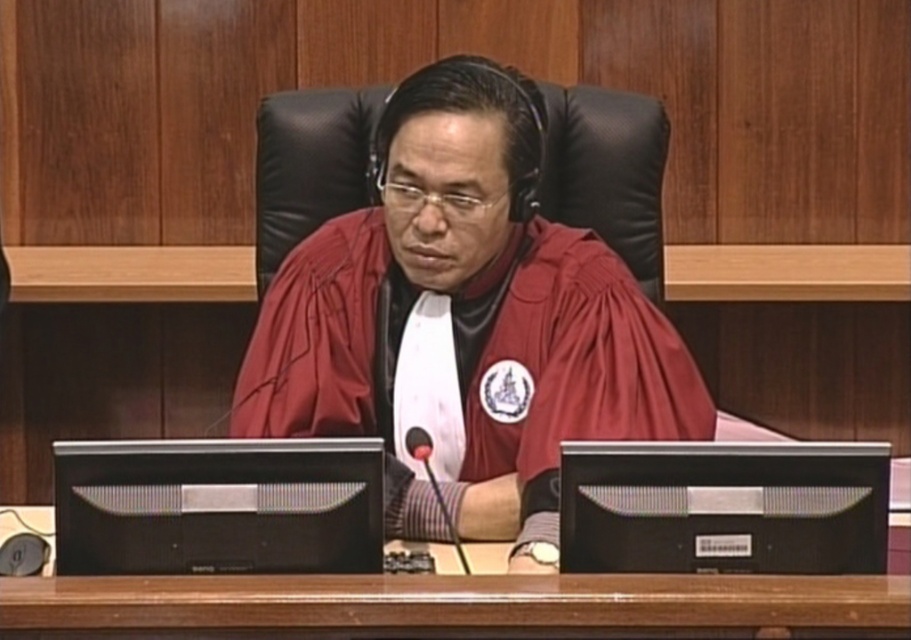
Question: Which object is the farthest from the black plastic monitor at center?

Choices:
 (A) brown wood table at center
 (B) black matte monitor at center

Answer: (B)

Question: Among these points, which one is farthest from the camera?

Choices:
 (A) (221, 468)
 (B) (754, 540)
 (C) (203, 579)
 (D) (293, 218)

Answer: (D)

Question: Can you confirm if brown wood table at center is positioned to the left of black leather chair at center?

Choices:
 (A) yes
 (B) no

Answer: (A)

Question: Which of the following is the closest to the observer?

Choices:
 (A) (279, 145)
 (B) (384, 276)
 (C) (509, 580)

Answer: (C)

Question: Where is matte red robe at center located in relation to black matte monitor at center in the image?

Choices:
 (A) right
 (B) left

Answer: (A)

Question: Can you confirm if black matte monitor at center is thinner than black plastic monitor at center?

Choices:
 (A) no
 (B) yes

Answer: (A)